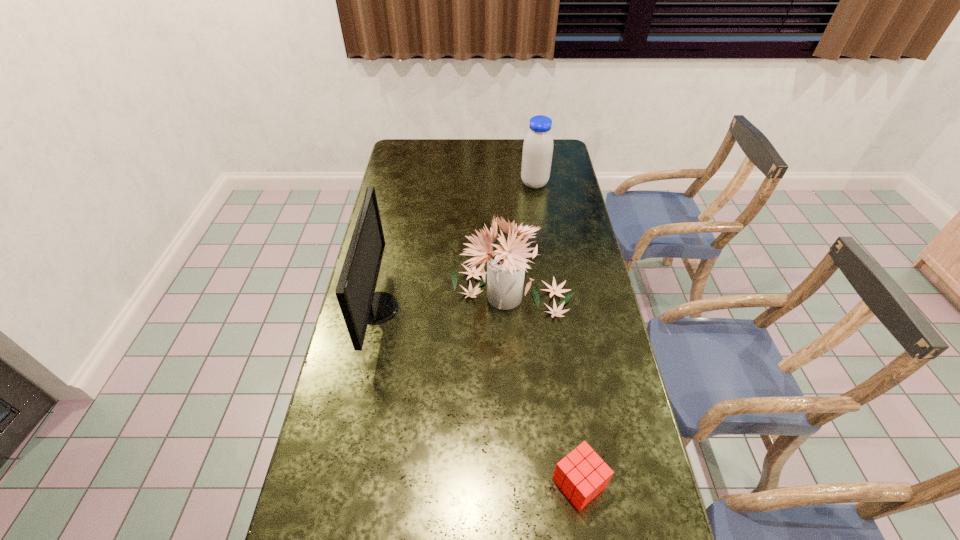
You are a GUI agent. You are given a task and a screenshot of the screen. Output one action in this format:
    pyautogui.click(x=<x>, y=<y>)
    Task: Click on the free area in between the bouquet and the leftmost object
    The height and width of the screenshot is (540, 960).
    Given the screenshot: What is the action you would take?
    pyautogui.click(x=445, y=300)

Where is `vacant area that lies between the soya milk and the leftmost object`? vacant area that lies between the soya milk and the leftmost object is located at coordinates tap(456, 246).

Where is `empty space between the shortest object and the computer monitor`? This screenshot has width=960, height=540. empty space between the shortest object and the computer monitor is located at coordinates (478, 395).

Locate an element on the screen. This screenshot has height=540, width=960. free area in between the leftmost object and the bouquet is located at coordinates (445, 300).

Find the location of `object identified as the closest to the leftmost object`. object identified as the closest to the leftmost object is located at coordinates (506, 264).

The width and height of the screenshot is (960, 540). Find the location of `object that is the closest to the bouquet`. object that is the closest to the bouquet is located at coordinates (359, 303).

Identify the location of free spot that satisfies the following two spatial constraints: 1. on the front side of the bouquet; 2. on the front-facing side of the leftmost object. The image size is (960, 540). (514, 308).

This screenshot has height=540, width=960. What are the coordinates of `free space that satisfies the following two spatial constraints: 1. on the front-facing side of the nearest object; 2. on the right side of the computer monitor` in the screenshot? It's located at (341, 483).